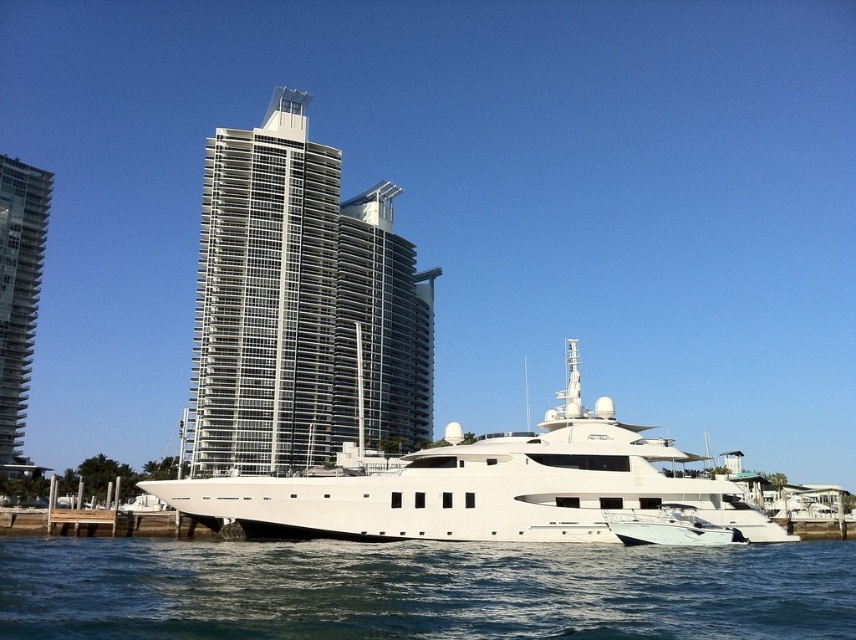
Which is below, silver glass skyscraper at center or white glossy motorboat at lower right?

white glossy motorboat at lower right is below.

Which of these two, silver glass skyscraper at center or white glossy motorboat at lower right, stands taller?

With more height is silver glass skyscraper at center.

Locate an element on the screen. Image resolution: width=856 pixels, height=640 pixels. silver glass skyscraper at center is located at coordinates (299, 305).

Between white glossy yacht at center and white glossy motorboat at lower right, which one is positioned higher?

Positioned higher is white glossy motorboat at lower right.

Is point (666, 452) positioned in front of point (681, 545)?

No, it is not.

Where is `white glossy yacht at center`? Image resolution: width=856 pixels, height=640 pixels. white glossy yacht at center is located at coordinates (482, 486).

Does clear blue water at lower center come in front of glassy steel skyscraper at left?

Yes, it is.

Between clear blue water at lower center and glassy steel skyscraper at left, which one is positioned lower?

clear blue water at lower center is below.

Identify the location of clear blue water at lower center. This screenshot has width=856, height=640. (421, 589).